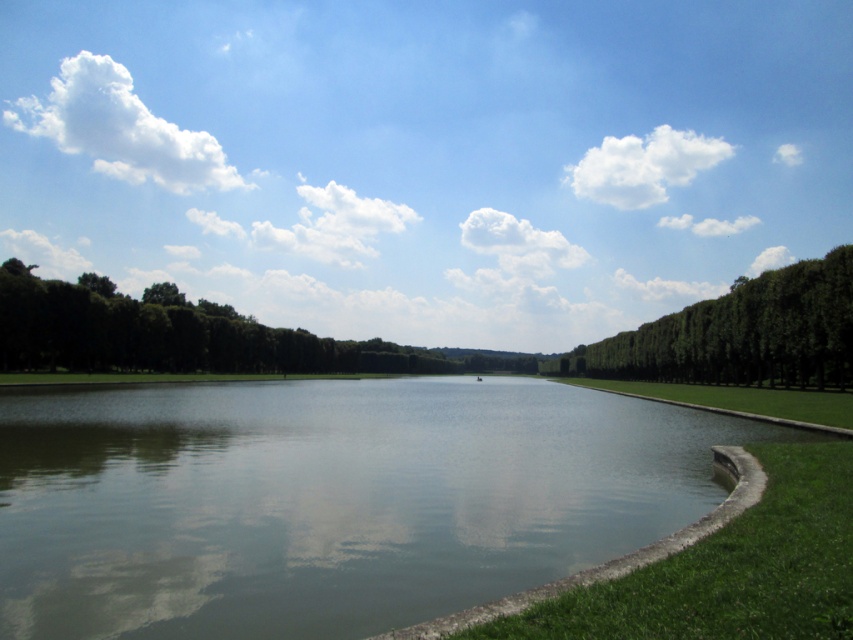
Does green grassy lake at center have a greater width compared to green grass at right?

Yes, green grassy lake at center is wider than green grass at right.

Looking at this image, does green grassy lake at center come in front of green grass at right?

Yes, green grassy lake at center is closer to the viewer.

The height and width of the screenshot is (640, 853). What are the coordinates of `green grassy lake at center` in the screenshot? It's located at (329, 499).

Between point (830, 332) and point (566, 378), which one is positioned in front?

Point (830, 332) is in front.

Is green leafy trees at upper right positioned at the back of green grass at right?

Yes.

Does point (766, 378) come farther from viewer compared to point (601, 387)?

No.

This screenshot has width=853, height=640. Identify the location of green leafy trees at upper right. (741, 333).

Can you confirm if green grassy lake at center is wider than green leafy trees at upper right?

Yes.

Between green grassy lake at center and green leafy trees at upper right, which one appears on the right side from the viewer's perspective?

From the viewer's perspective, green leafy trees at upper right appears more on the right side.

The width and height of the screenshot is (853, 640). What are the coordinates of `green grassy lake at center` in the screenshot? It's located at (329, 499).